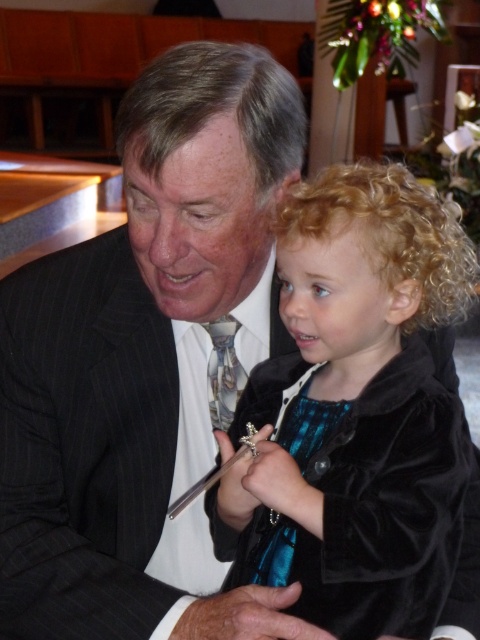
Question: Can you confirm if velvet black jacket at center is thinner than patterned silk tie at center?

Choices:
 (A) yes
 (B) no

Answer: (B)

Question: Which point is closer to the camera?

Choices:
 (A) click(x=243, y=381)
 (B) click(x=356, y=353)

Answer: (B)

Question: Can you confirm if velvet black jacket at center is positioned above patterned silk tie at center?

Choices:
 (A) yes
 (B) no

Answer: (B)

Question: Is velvet black jacket at center thinner than patterned silk tie at center?

Choices:
 (A) no
 (B) yes

Answer: (A)